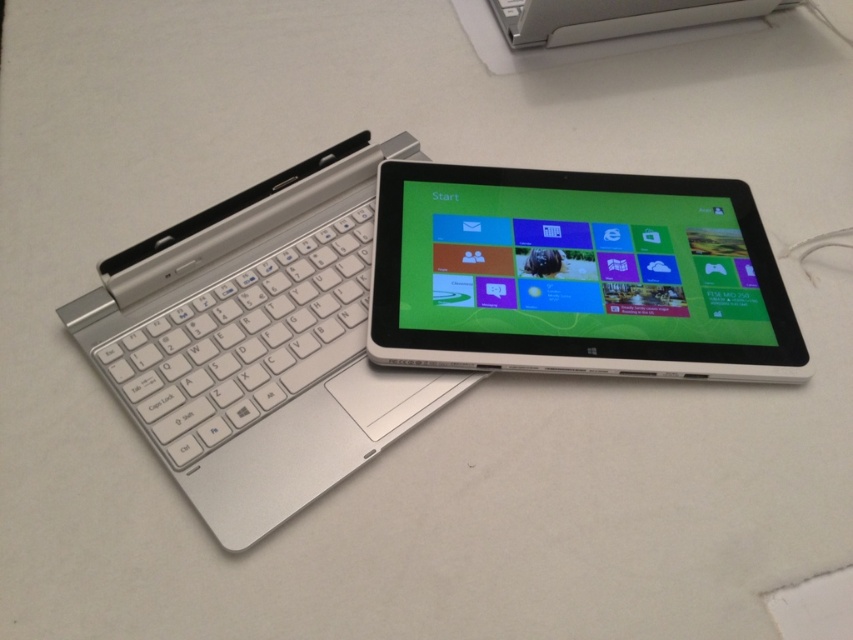
Does white plastic tablet at center appear on the left side of silver metallic keyboard at left?

No, white plastic tablet at center is not to the left of silver metallic keyboard at left.

This screenshot has height=640, width=853. Describe the element at coordinates (576, 275) in the screenshot. I see `white plastic tablet at center` at that location.

Locate an element on the screen. This screenshot has height=640, width=853. white plastic tablet at center is located at coordinates (576, 275).

Does silver metallic laptop at upper left appear under white plastic tablet at center?

Yes, silver metallic laptop at upper left is below white plastic tablet at center.

Between silver metallic laptop at upper left and white plastic tablet at center, which one is positioned higher?

white plastic tablet at center is higher up.

Does point (407, 138) come in front of point (397, 305)?

No, (407, 138) is further to viewer.

You are a GUI agent. You are given a task and a screenshot of the screen. Output one action in this format:
    pyautogui.click(x=<x>, y=<y>)
    Task: Click on the silver metallic laptop at upper left
    Image resolution: width=853 pixels, height=640 pixels.
    Given the screenshot: What is the action you would take?
    pyautogui.click(x=258, y=342)

Is silver metallic laptop at upper left further to the viewer compared to silver metallic keyboard at left?

No, it is in front of silver metallic keyboard at left.

Looking at this image, does silver metallic laptop at upper left have a lesser width compared to silver metallic keyboard at left?

In fact, silver metallic laptop at upper left might be wider than silver metallic keyboard at left.

This screenshot has width=853, height=640. Find the location of `silver metallic laptop at upper left`. silver metallic laptop at upper left is located at coordinates (258, 342).

In order to click on silver metallic laptop at upper left in this screenshot , I will do `click(258, 342)`.